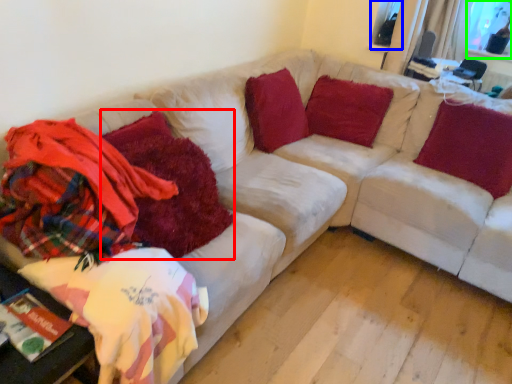
Question: Which object is positioned farthest from blanket (highlighted by a red box)? Select from window screen (highlighted by a blue box) and window screen (highlighted by a green box).

Choices:
 (A) window screen
 (B) window screen

Answer: (B)